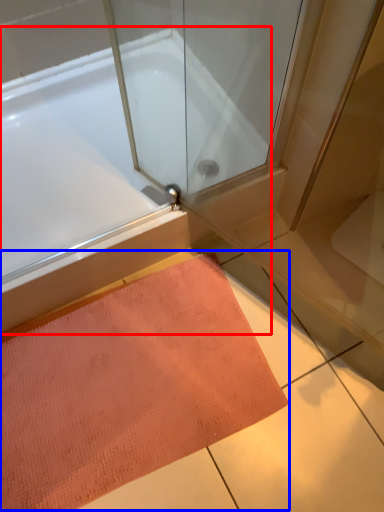
Question: Which object appears farthest to the camera in this image, bathtub (highlighted by a red box) or doormat (highlighted by a blue box)?

Choices:
 (A) bathtub
 (B) doormat

Answer: (A)